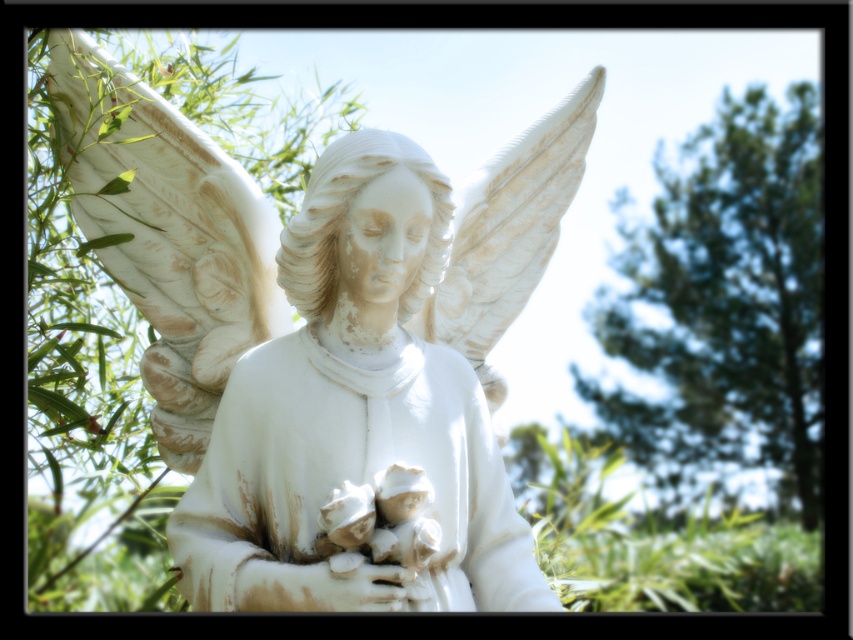
You are standing in front of the angel statue and want to locate the point at coordinates (727,305). Based on the scene description, where would this point be located?

The point at coordinates (727,305) is on the green leafy tree at upper right.

You are standing in a park and see the white marble statue at center. If you want to find the statue quickly, where should you look based on its 2D coordinates?

The white marble statue at center is located at the 2D coordinates point (167, 234), so you should look there to find it quickly.